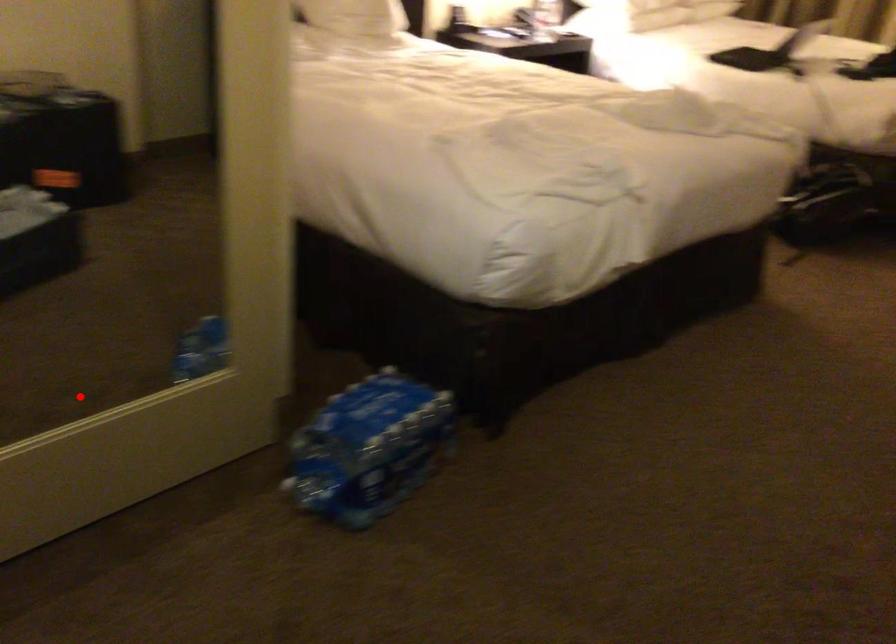
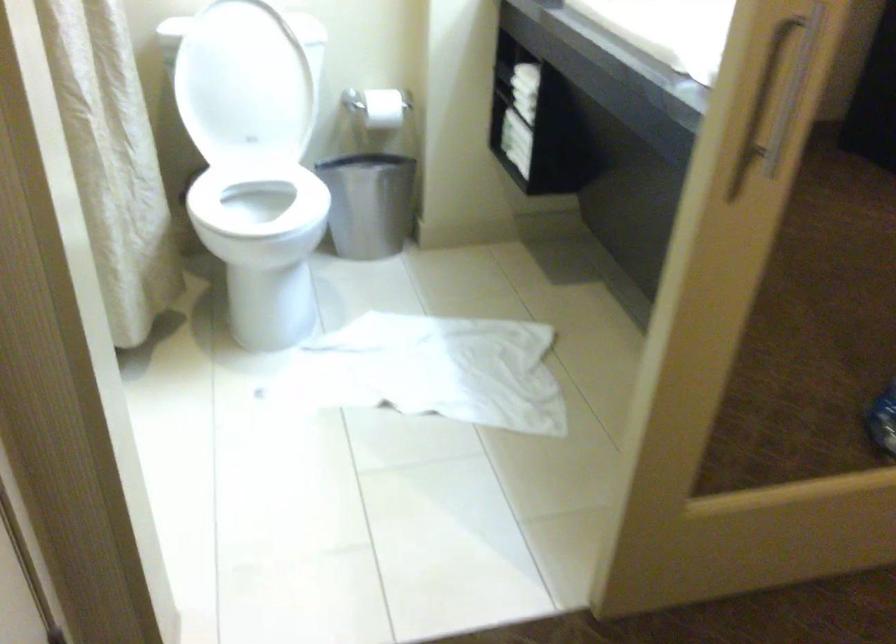
Locate, in the second image, the point that corresponds to the highlighted location in the first image.

(754, 422)